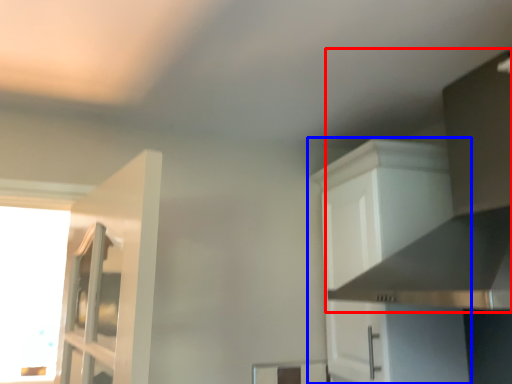
Question: Which of the following is the closest to the observer, vent (highlighted by a red box) or cabinetry (highlighted by a blue box)?

Choices:
 (A) vent
 (B) cabinetry

Answer: (A)